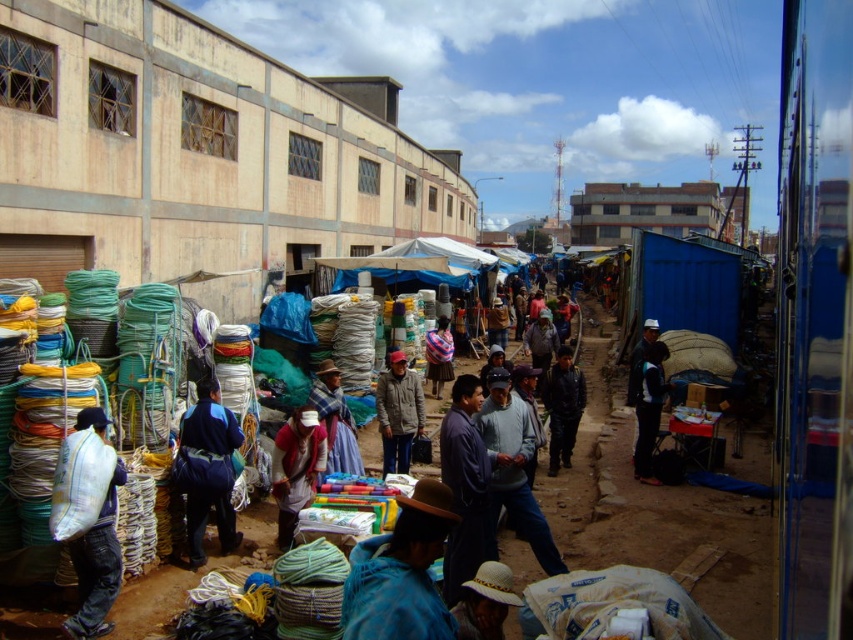
Which of these two, white fabric bag at lower left or blue fabric jacket at center, stands taller?

Standing taller between the two is blue fabric jacket at center.

Does point (77, 577) come in front of point (189, 461)?

Yes, it is.

You are a GUI agent. You are given a task and a screenshot of the screen. Output one action in this format:
    pyautogui.click(x=<x>, y=<y>)
    Task: Click on the white fabric bag at lower left
    The width and height of the screenshot is (853, 640).
    Given the screenshot: What is the action you would take?
    pyautogui.click(x=91, y=550)

Who is more forward, (549, 435) or (335, 376)?

Point (335, 376) is more forward.

Can you confirm if dark blue leather jacket at center is positioned below blue woven fabric at center?

Yes, dark blue leather jacket at center is below blue woven fabric at center.

The width and height of the screenshot is (853, 640). Find the location of `dark blue leather jacket at center`. dark blue leather jacket at center is located at coordinates (561, 406).

Does point (492, 387) come farther from viewer compared to point (184, 492)?

No, it is not.

Is gray wool sweater at center shorter than blue fabric jacket at center?

Incorrect, gray wool sweater at center's height does not fall short of blue fabric jacket at center's.

Measure the distance between point (544,556) and camera.

A distance of 7.21 meters exists between point (544,556) and camera.

The height and width of the screenshot is (640, 853). I want to click on gray wool sweater at center, so click(x=514, y=468).